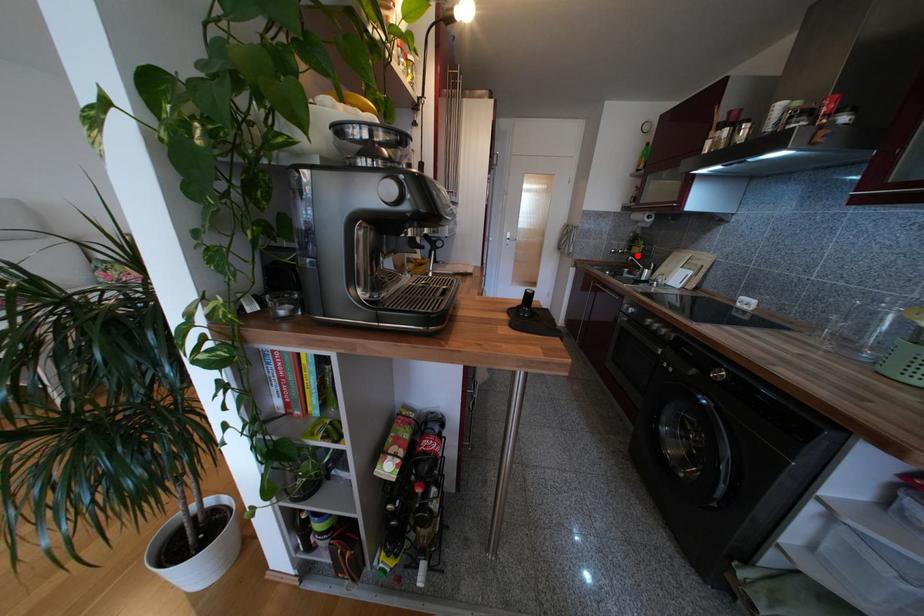
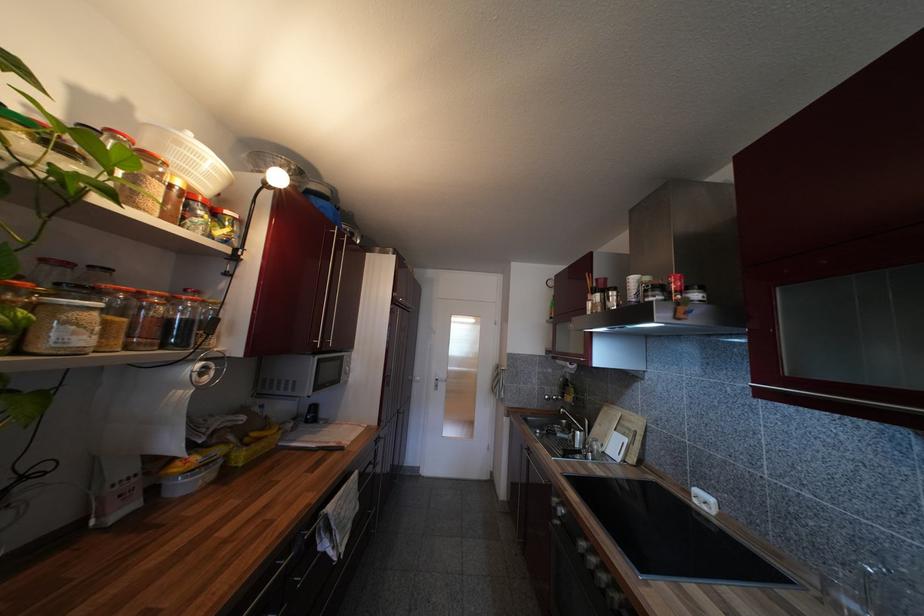
Find the pixel in the second image that matches the highlighted location in the first image.

(570, 405)